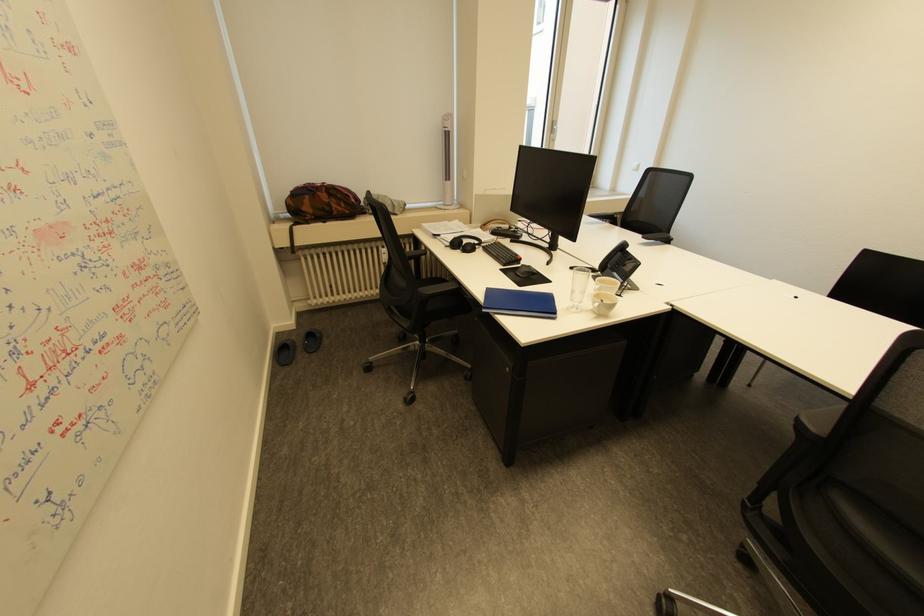
The height and width of the screenshot is (616, 924). What are the coordinates of `patterned backpack` in the screenshot? It's located at coord(322,203).